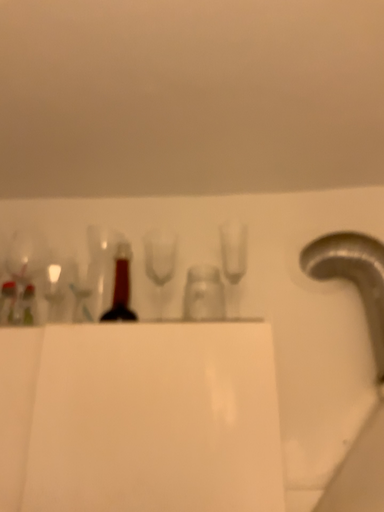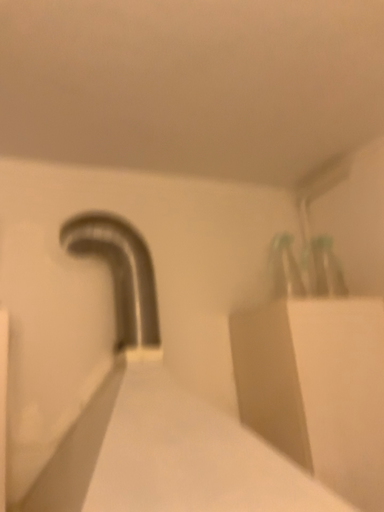
Question: How did the camera likely rotate when shooting the video?

Choices:
 (A) rotated downward
 (B) rotated upward

Answer: (A)